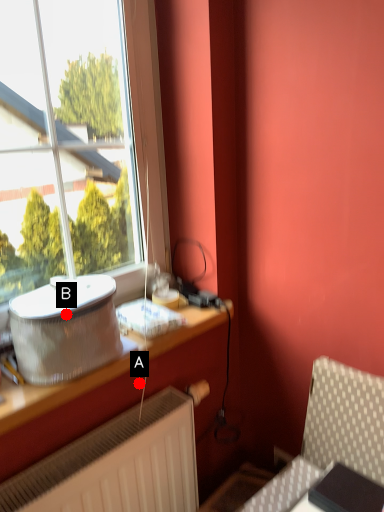
Question: Two points are circled on the image, labeled by A and B beside each circle. Which point is farther from the camera taking this photo?

Choices:
 (A) A is further
 (B) B is further

Answer: (A)